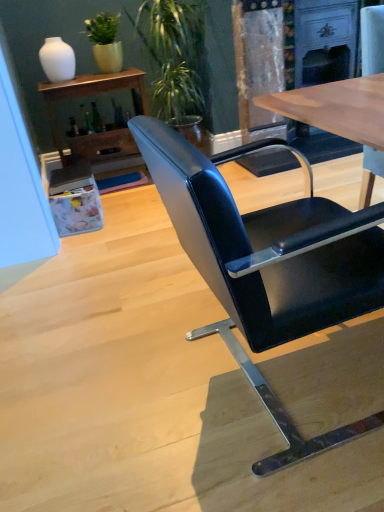
Question: Considering the positions of point (89, 34) and point (218, 270), is point (89, 34) closer or farther from the camera than point (218, 270)?

Choices:
 (A) closer
 (B) farther

Answer: (B)

Question: Visually, is green matte plant at upper left, placed as the second houseplant when sorted from right to left, positioned to the left or to the right of black leather chair at center?

Choices:
 (A) left
 (B) right

Answer: (A)

Question: Estimate the real-world distances between objects in this image. Which object is closer to the white glossy vase at upper left?

Choices:
 (A) green leafy plant at upper center, the first houseplant positioned from the right
 (B) black leather chair at center
 (C) matte wood shelf at upper left
 (D) green matte plant at upper left, the first houseplant positioned from the left

Answer: (D)

Question: Which is farther from the green leafy plant at upper center, the first houseplant positioned from the right?

Choices:
 (A) matte wood shelf at upper left
 (B) green matte plant at upper left, placed as the second houseplant when sorted from right to left
 (C) white glossy vase at upper left
 (D) black leather chair at center

Answer: (D)